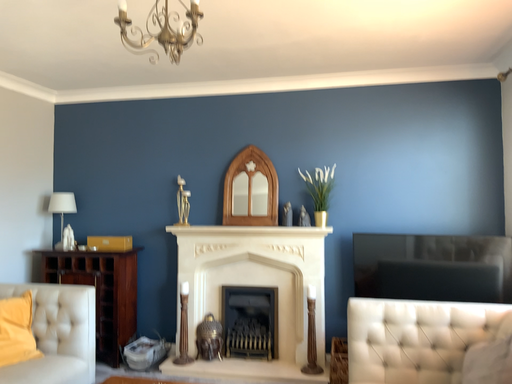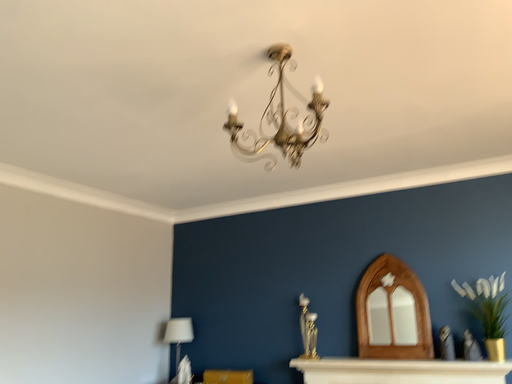
Question: How did the camera likely rotate when shooting the video?

Choices:
 (A) rotated downward
 (B) rotated upward

Answer: (B)